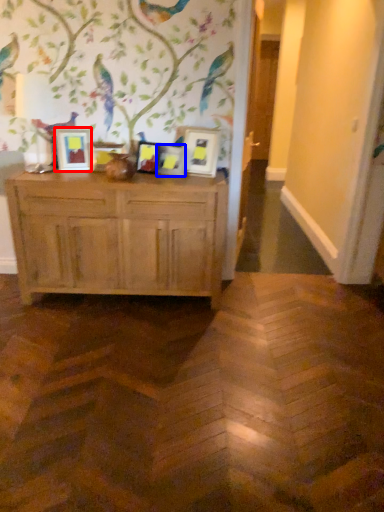
Question: Which object appears closest to the camera in this image, picture frame (highlighted by a red box) or picture frame (highlighted by a blue box)?

Choices:
 (A) picture frame
 (B) picture frame

Answer: (A)